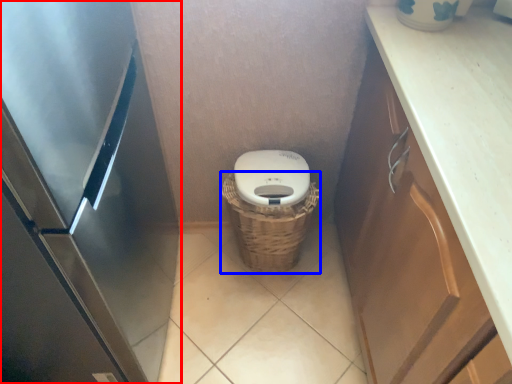
Question: Which object appears farthest to the camera in this image, appliance (highlighted by a red box) or basket (highlighted by a blue box)?

Choices:
 (A) appliance
 (B) basket

Answer: (B)